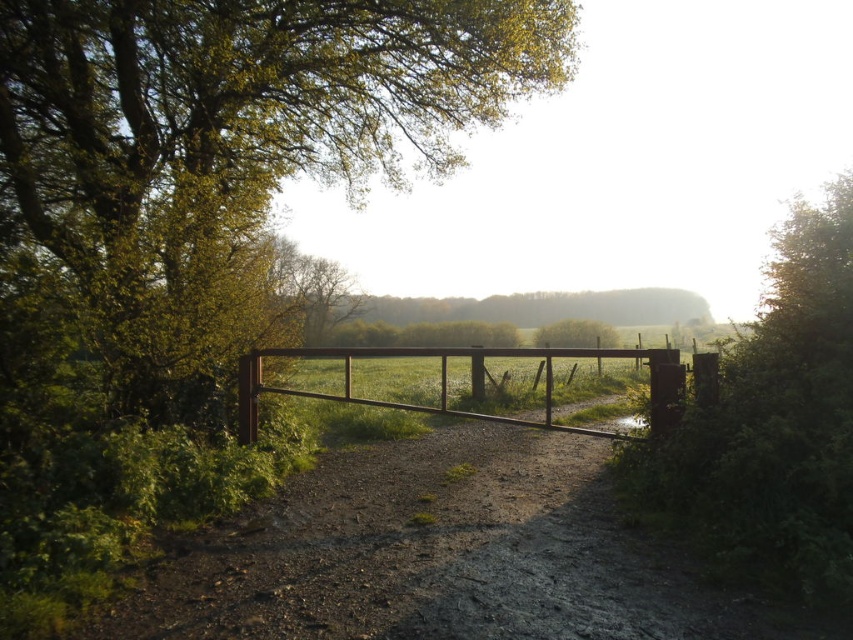
Question: Which point is closer to the camera?

Choices:
 (A) (575, 26)
 (B) (254, 353)

Answer: (B)

Question: Is green leafy tree at center behind brown wooden gate at center?

Choices:
 (A) no
 (B) yes

Answer: (B)

Question: Among these points, which one is farthest from the camera?

Choices:
 (A) (463, 349)
 (B) (160, 253)

Answer: (B)

Question: Is green leafy tree at center wider than brown wooden gate at center?

Choices:
 (A) no
 (B) yes

Answer: (A)

Question: Is green leafy tree at center thinner than brown wooden gate at center?

Choices:
 (A) no
 (B) yes

Answer: (B)